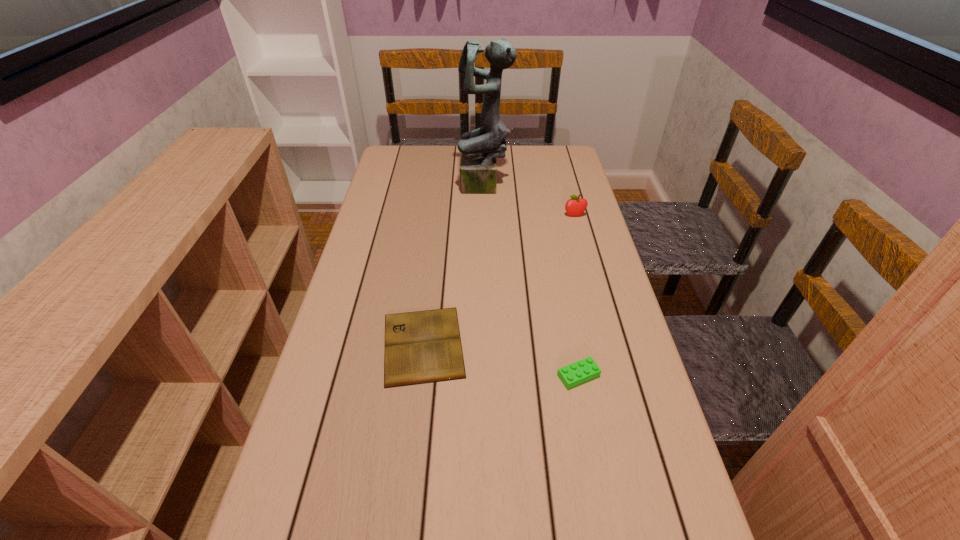
This screenshot has height=540, width=960. I want to click on the tallest object, so click(479, 148).

What are the coordinates of `sculpture` in the screenshot? It's located at (479, 148).

At what (x,y) coordinates should I click in order to perform the action: click on the second tallest object. Please return your answer as a coordinate pair (x, y). Looking at the image, I should click on (576, 206).

The image size is (960, 540). Identify the location of the rightmost object. coord(576,206).

Where is `the third object from left to right`? The height and width of the screenshot is (540, 960). the third object from left to right is located at coordinates (584, 370).

Find the location of a particular element. Lego is located at coordinates (584, 370).

Identify the location of the shortest object. (421, 347).

Locate an element on the screen. Image resolution: width=960 pixels, height=540 pixels. blank area located 0.100m on the face of the sculpture is located at coordinates (431, 187).

Image resolution: width=960 pixels, height=540 pixels. Find the location of `vacant position located 0.240m on the face of the sculpture`. vacant position located 0.240m on the face of the sculpture is located at coordinates (392, 187).

Where is `free space located on the face of the sculpture`? free space located on the face of the sculpture is located at coordinates (411, 187).